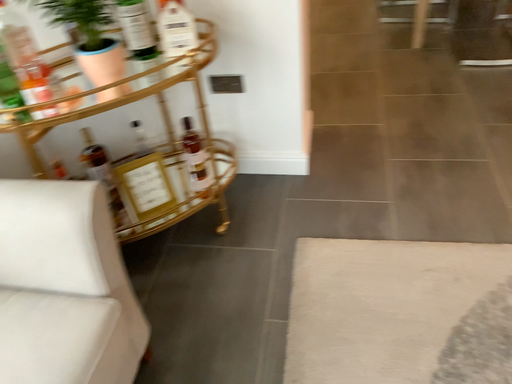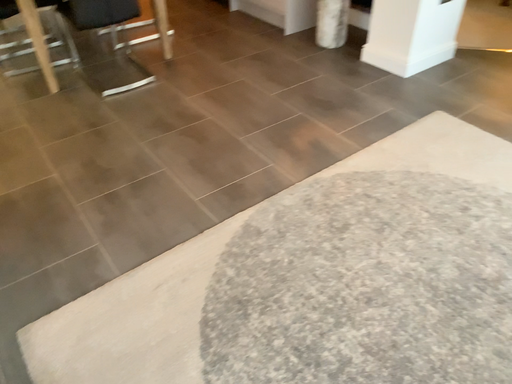
Question: How did the camera likely rotate when shooting the video?

Choices:
 (A) rotated left
 (B) rotated right

Answer: (B)